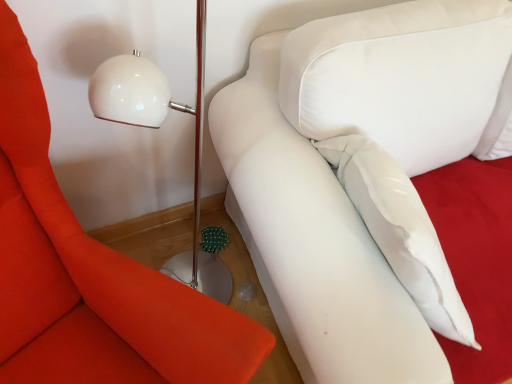
Question: Choose the correct answer: Is white soft couch at upper right inside white fabric pillow at upper right or outside it?

Choices:
 (A) outside
 (B) inside

Answer: (A)

Question: From a real-world perspective, is white soft couch at upper right positioned above or below white fabric pillow at upper right?

Choices:
 (A) below
 (B) above

Answer: (A)

Question: From the image's perspective, is white soft couch at upper right positioned above or below white fabric pillow at upper right?

Choices:
 (A) below
 (B) above

Answer: (B)

Question: From a real-world perspective, is white fabric pillow at upper right positioned above or below white soft couch at upper right?

Choices:
 (A) above
 (B) below

Answer: (A)

Question: Does point (27, 162) appear closer or farther from the camera than point (429, 354)?

Choices:
 (A) farther
 (B) closer

Answer: (A)

Question: Do you think white fabric pillow at upper right is within white soft couch at upper right, or outside of it?

Choices:
 (A) outside
 (B) inside

Answer: (A)

Question: Is white fabric pillow at upper right taller or shorter than white soft couch at upper right?

Choices:
 (A) short
 (B) tall

Answer: (B)